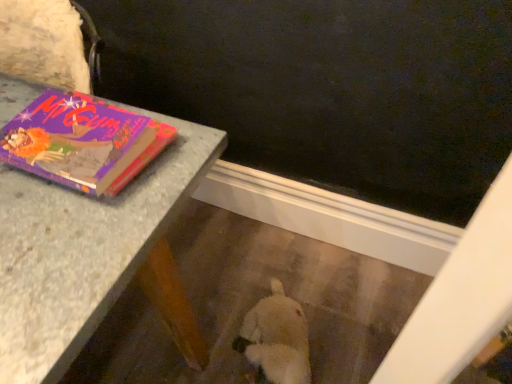
Question: Is granite table at upper left turned away from purple matte book at upper left?

Choices:
 (A) no
 (B) yes

Answer: (A)

Question: Does granite table at upper left come behind purple matte book at upper left?

Choices:
 (A) no
 (B) yes

Answer: (B)

Question: Considering the relative sizes of granite table at upper left and purple matte book at upper left in the image provided, is granite table at upper left shorter than purple matte book at upper left?

Choices:
 (A) no
 (B) yes

Answer: (A)

Question: Are granite table at upper left and purple matte book at upper left far apart?

Choices:
 (A) yes
 (B) no

Answer: (B)

Question: Can you confirm if granite table at upper left is taller than purple matte book at upper left?

Choices:
 (A) yes
 (B) no

Answer: (A)

Question: Is granite table at upper left bigger than purple matte book at upper left?

Choices:
 (A) no
 (B) yes

Answer: (B)

Question: Considering the relative sizes of purple matte book at upper left and granite table at upper left in the image provided, is purple matte book at upper left bigger than granite table at upper left?

Choices:
 (A) no
 (B) yes

Answer: (A)

Question: From a real-world perspective, does purple matte book at upper left sit lower than granite table at upper left?

Choices:
 (A) yes
 (B) no

Answer: (B)

Question: Could you tell me if purple matte book at upper left is facing granite table at upper left?

Choices:
 (A) no
 (B) yes

Answer: (A)

Question: Is purple matte book at upper left facing away from granite table at upper left?

Choices:
 (A) no
 (B) yes

Answer: (A)

Question: Does purple matte book at upper left have a greater height compared to granite table at upper left?

Choices:
 (A) no
 (B) yes

Answer: (A)

Question: Does purple matte book at upper left have a smaller size compared to granite table at upper left?

Choices:
 (A) yes
 (B) no

Answer: (A)

Question: Do you think granite table at upper left is within purple matte book at upper left, or outside of it?

Choices:
 (A) outside
 (B) inside

Answer: (A)